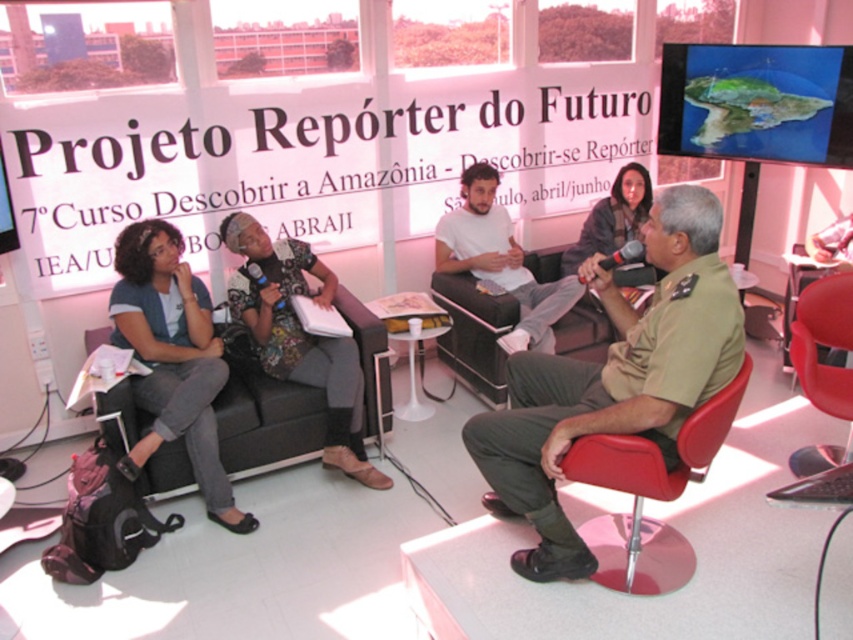
Question: Observing the image, what is the correct spatial positioning of khaki uniform at center in reference to matte white shirt at center?

Choices:
 (A) below
 (B) above

Answer: (A)

Question: Which of these objects is positioned closest to the khaki uniform at center?

Choices:
 (A) red leather chair at lower right
 (B) matte white shirt at center

Answer: (A)

Question: Which point appears closest to the camera in this image?

Choices:
 (A) (651, 586)
 (B) (492, 280)
 (C) (573, 536)

Answer: (C)

Question: Does khaki uniform at center have a smaller size compared to matte white shirt at center?

Choices:
 (A) no
 (B) yes

Answer: (A)

Question: In this image, where is red leather chair at lower right located relative to matte white shirt at center?

Choices:
 (A) above
 (B) below

Answer: (B)

Question: Which point is closer to the camera taking this photo?

Choices:
 (A) (670, 442)
 (B) (647, 566)

Answer: (A)